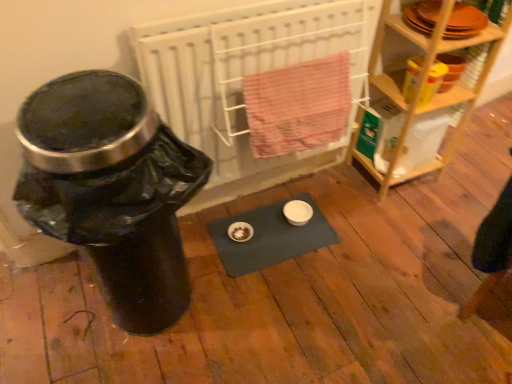
Question: Is blue fabric yoga mat at center positioned in front of white radiator at center?

Choices:
 (A) no
 (B) yes

Answer: (A)

Question: Can you confirm if blue fabric yoga mat at center is positioned to the left of white radiator at center?

Choices:
 (A) yes
 (B) no

Answer: (B)

Question: Can you confirm if blue fabric yoga mat at center is shorter than white radiator at center?

Choices:
 (A) yes
 (B) no

Answer: (A)

Question: Considering the relative sizes of blue fabric yoga mat at center and white radiator at center in the image provided, is blue fabric yoga mat at center smaller than white radiator at center?

Choices:
 (A) no
 (B) yes

Answer: (B)

Question: Does blue fabric yoga mat at center have a greater height compared to white radiator at center?

Choices:
 (A) no
 (B) yes

Answer: (A)

Question: From their relative heights in the image, would you say white radiator at center is taller or shorter than black plastic water cooler at left?

Choices:
 (A) short
 (B) tall

Answer: (A)

Question: Looking at their shapes, would you say white radiator at center is wider or thinner than black plastic water cooler at left?

Choices:
 (A) wide
 (B) thin

Answer: (B)

Question: Looking at the image, does white radiator at center seem bigger or smaller compared to black plastic water cooler at left?

Choices:
 (A) big
 (B) small

Answer: (B)

Question: Would you say white radiator at center is inside or outside black plastic water cooler at left?

Choices:
 (A) inside
 (B) outside

Answer: (B)

Question: From their relative heights in the image, would you say wooden shelf at right is taller or shorter than black plastic water cooler at left?

Choices:
 (A) short
 (B) tall

Answer: (B)

Question: Is wooden shelf at right bigger or smaller than black plastic water cooler at left?

Choices:
 (A) big
 (B) small

Answer: (B)

Question: Considering their positions, is wooden shelf at right located in front of or behind black plastic water cooler at left?

Choices:
 (A) front
 (B) behind

Answer: (B)

Question: From a real-world perspective, is wooden shelf at right positioned above or below black plastic water cooler at left?

Choices:
 (A) above
 (B) below

Answer: (A)

Question: From a real-world perspective, is white radiator at center physically located above or below blue fabric yoga mat at center?

Choices:
 (A) below
 (B) above

Answer: (B)

Question: Relative to blue fabric yoga mat at center, is white radiator at center in front or behind?

Choices:
 (A) front
 (B) behind

Answer: (A)